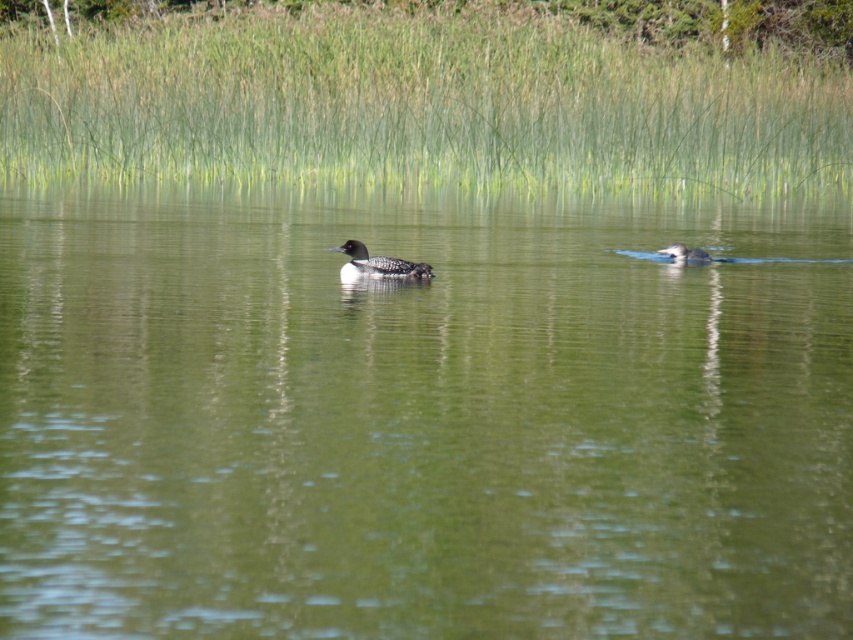
Can you confirm if green smooth water at center is wider than dark gray matte duck at center?

Indeed, green smooth water at center has a greater width compared to dark gray matte duck at center.

Which is in front, point (613, 266) or point (352, 259)?

Point (352, 259) is in front.

Find the location of `green smooth water at center`. green smooth water at center is located at coordinates (421, 417).

Does green smooth water at center lie behind dark gray duck at center?

That is False.

Is point (453, 625) farther from viewer compared to point (689, 260)?

No, (453, 625) is closer to viewer.

Is point (651, 520) positioned behind point (688, 259)?

No, (651, 520) is in front of (688, 259).

At what (x,y) coordinates should I click in order to perform the action: click on green smooth water at center. Please return your answer as a coordinate pair (x, y). The height and width of the screenshot is (640, 853). Looking at the image, I should click on (421, 417).

This screenshot has height=640, width=853. Describe the element at coordinates (421, 417) in the screenshot. I see `green smooth water at center` at that location.

The width and height of the screenshot is (853, 640). I want to click on green smooth water at center, so click(x=421, y=417).